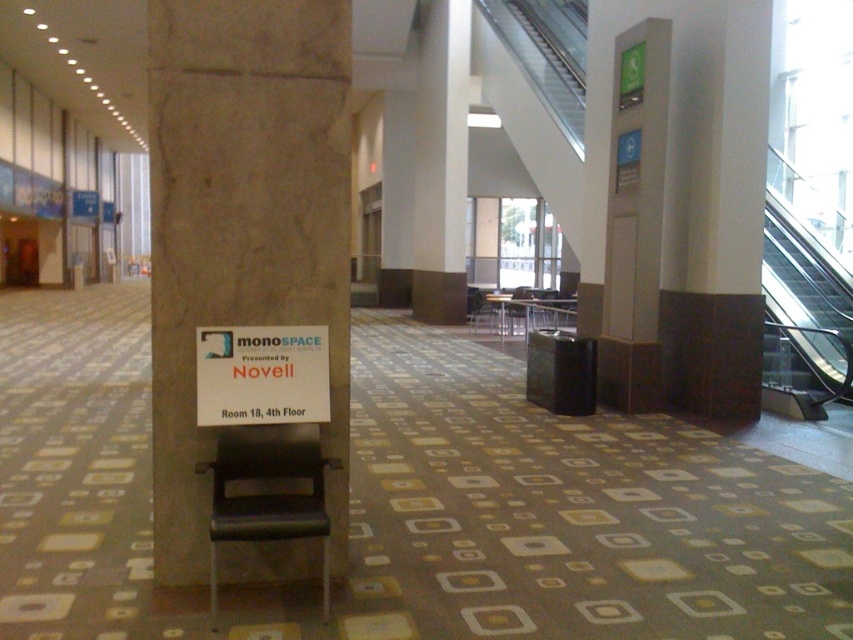
Is brown marble pillar at center thinner than black glass stairs at upper right?

Correct, brown marble pillar at center's width is less than black glass stairs at upper right's.

Does brown marble pillar at center appear on the right side of black glass stairs at upper right?

No, brown marble pillar at center is not to the right of black glass stairs at upper right.

Between point (306, 176) and point (763, 241), which one is positioned in front?

Point (306, 176)

Find the location of a particular element. The height and width of the screenshot is (640, 853). brown marble pillar at center is located at coordinates (244, 237).

Consider the image. Can you confirm if brown marble pillar at center is bigger than gray concrete pillar at right?

Incorrect, brown marble pillar at center is not larger than gray concrete pillar at right.

Does brown marble pillar at center appear under gray concrete pillar at right?

Indeed, brown marble pillar at center is positioned under gray concrete pillar at right.

Is point (209, 188) positioned in front of point (637, 22)?

Yes.

Where is `brown marble pillar at center`? The height and width of the screenshot is (640, 853). brown marble pillar at center is located at coordinates (244, 237).

Does gray concrete pillar at right appear on the left side of black glass stairs at upper right?

Indeed, gray concrete pillar at right is positioned on the left side of black glass stairs at upper right.

Does gray concrete pillar at right have a lesser width compared to black glass stairs at upper right?

Indeed, gray concrete pillar at right has a lesser width compared to black glass stairs at upper right.

Between point (640, 403) and point (782, 364), which one is positioned behind?

The point (782, 364) is more distant.

You are a GUI agent. You are given a task and a screenshot of the screen. Output one action in this format:
    pyautogui.click(x=<x>, y=<y>)
    Task: Click on the gray concrete pillar at right
    
    Given the screenshot: What is the action you would take?
    pyautogui.click(x=634, y=220)